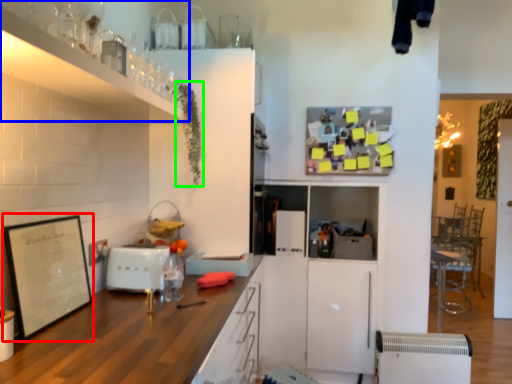
Question: Which is nearer to the picture frame (highlighted by a red box)? cabinetry (highlighted by a blue box) or plant (highlighted by a green box).

Choices:
 (A) cabinetry
 (B) plant

Answer: (A)